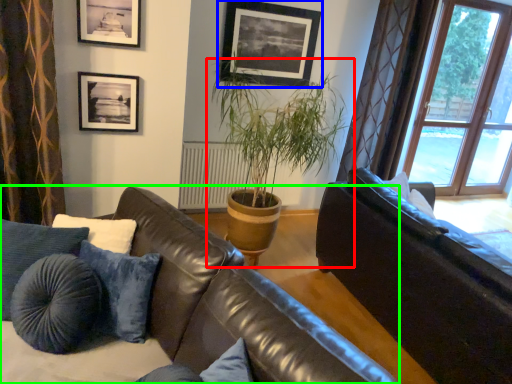
Question: Which object is positioned farthest from houseplant (highlighted by a red box)? Select from picture frame (highlighted by a blue box) and studio couch (highlighted by a green box).

Choices:
 (A) picture frame
 (B) studio couch

Answer: (B)